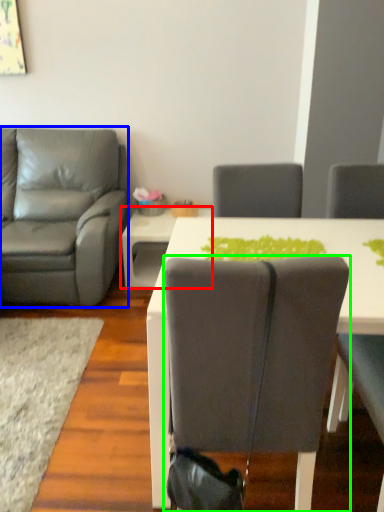
Question: Which is nearer to the table (highlighted by a red box)? chair (highlighted by a blue box) or chair (highlighted by a green box).

Choices:
 (A) chair
 (B) chair

Answer: (A)